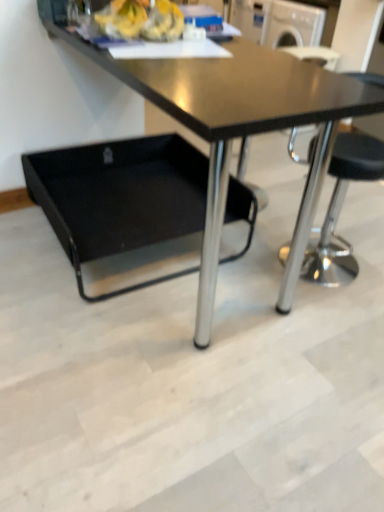
Locate an element on the screen. This screenshot has width=384, height=512. black glossy table at center is located at coordinates (243, 129).

Describe the element at coordinates (243, 129) in the screenshot. I see `black glossy table at center` at that location.

Measure the distance between black plastic swivel chair at lower left and camera.

The depth of black plastic swivel chair at lower left is 1.75 meters.

Describe the element at coordinates (120, 198) in the screenshot. I see `black plastic swivel chair at lower left` at that location.

What is the approximate width of black plastic swivel chair at lower left?

It is 28.58 inches.

This screenshot has width=384, height=512. Find the location of `black plastic swivel chair at lower left`. black plastic swivel chair at lower left is located at coordinates (120, 198).

Where is `black glossy table at center`? black glossy table at center is located at coordinates (243, 129).

Considering the relative positions of black glossy table at center and black plastic swivel chair at lower left in the image provided, is black glossy table at center to the right of black plastic swivel chair at lower left from the viewer's perspective?

Yes.

From the picture: Is black glossy table at center positioned in front of black plastic swivel chair at lower left?

Yes, black glossy table at center is closer to the camera.

Considering the positions of point (207, 309) and point (94, 204), is point (207, 309) closer or farther from the camera than point (94, 204)?

Point (207, 309) appears to be closer to the viewer than point (94, 204).

From the image's perspective, is black glossy table at center on top of black plastic swivel chair at lower left?

Yes, from the image's perspective, black glossy table at center is over black plastic swivel chair at lower left.

From a real-world perspective, is black glossy table at center positioned over black plastic swivel chair at lower left based on gravity?

Indeed, from a real-world perspective, black glossy table at center stands above black plastic swivel chair at lower left.

Looking at their sizes, would you say black glossy table at center is wider or thinner than black plastic swivel chair at lower left?

In the image, black glossy table at center appears to be more narrow than black plastic swivel chair at lower left.

In terms of height, does black glossy table at center look taller or shorter compared to black plastic swivel chair at lower left?

Clearly, black glossy table at center is taller compared to black plastic swivel chair at lower left.

Which of these two, black glossy table at center or black plastic swivel chair at lower left, is smaller?

With smaller size is black plastic swivel chair at lower left.

Would you say black glossy table at center is inside or outside black plastic swivel chair at lower left?

black glossy table at center is located beyond the bounds of black plastic swivel chair at lower left.

Can you see black glossy table at center touching black plastic swivel chair at lower left?

No, black glossy table at center is not with black plastic swivel chair at lower left.

Is black glossy table at center looking in the opposite direction of black plastic swivel chair at lower left?

Yes, black glossy table at center is facing away from black plastic swivel chair at lower left.

How different are the orientations of black glossy table at center and black plastic swivel chair at lower left in degrees?

The facing directions of black glossy table at center and black plastic swivel chair at lower left are 0.000521 degrees apart.

How far apart are black glossy table at center and black plastic swivel chair at lower left?

black glossy table at center and black plastic swivel chair at lower left are 30.91 inches apart from each other.

Locate an element on the screen. The image size is (384, 512). swivel chair below the black glossy table at center (from the image's perspective) is located at coordinates point(120,198).

Considering the relative positions of black plastic swivel chair at lower left and black glossy table at center in the image provided, is black plastic swivel chair at lower left to the left or to the right of black glossy table at center?

black plastic swivel chair at lower left is positioned on black glossy table at center's left side.

Which object is further away from the camera taking this photo, black plastic swivel chair at lower left or black glossy table at center?

black plastic swivel chair at lower left is further from the camera.

Between point (72, 230) and point (197, 316), which one is positioned behind?

The point (72, 230) is farther.

From the image's perspective, which is above, black plastic swivel chair at lower left or black glossy table at center?

black glossy table at center appears higher in the image.

From a real-world perspective, is black plastic swivel chair at lower left physically above black glossy table at center?

Incorrect, from a real-world perspective, black plastic swivel chair at lower left is lower than black glossy table at center.

Which object is thinner, black plastic swivel chair at lower left or black glossy table at center?

black glossy table at center is thinner.

Considering the sizes of black plastic swivel chair at lower left and black glossy table at center in the image, is black plastic swivel chair at lower left taller or shorter than black glossy table at center?

black plastic swivel chair at lower left is shorter than black glossy table at center.

Considering the relative sizes of black plastic swivel chair at lower left and black glossy table at center in the image provided, is black plastic swivel chair at lower left smaller than black glossy table at center?

Correct, black plastic swivel chair at lower left occupies less space than black glossy table at center.

Does black plastic swivel chair at lower left contain black glossy table at center?

No.

Are black plastic swivel chair at lower left and black glossy table at center far apart?

Actually, black plastic swivel chair at lower left and black glossy table at center are a little close together.

Could you tell me if black plastic swivel chair at lower left is facing black glossy table at center?

Yes, black plastic swivel chair at lower left is aimed at black glossy table at center.

How distant is black plastic swivel chair at lower left from black glossy table at center?

black plastic swivel chair at lower left is 30.91 inches away from black glossy table at center.

Where is `swivel chair on the left of black glossy table at center`? swivel chair on the left of black glossy table at center is located at coordinates (120, 198).

Where is `swivel chair behind the black glossy table at center`? The height and width of the screenshot is (512, 384). swivel chair behind the black glossy table at center is located at coordinates (120, 198).

The image size is (384, 512). I want to click on table located on the right of black plastic swivel chair at lower left, so click(x=243, y=129).